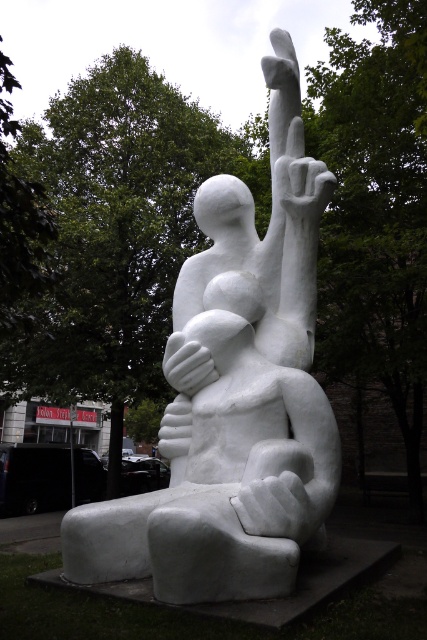
Which is in front, point (304, 200) or point (166, 348)?

Positioned in front is point (304, 200).

Can you confirm if white matte hand at upper center is bigger than white matte hand at center?

Incorrect, white matte hand at upper center is not larger than white matte hand at center.

Is point (318, 168) less distant than point (181, 349)?

No, it is not.

Find the location of `white matte hand at upper center`. white matte hand at upper center is located at coordinates (304, 188).

Is point (301, 349) closer to camera compared to point (284, 200)?

Yes, point (301, 349) is in front of point (284, 200).

Can you confirm if white stone sculpture at center is bigger than white matte hand at upper center?

Yes, white stone sculpture at center is bigger than white matte hand at upper center.

Where is `white stone sculpture at center`? white stone sculpture at center is located at coordinates (233, 404).

You are a GUI agent. You are given a task and a screenshot of the screen. Output one action in this format:
    pyautogui.click(x=<x>, y=<y>)
    Task: Click on the white stone sculpture at center
    Image resolution: width=427 pixels, height=640 pixels.
    Given the screenshot: What is the action you would take?
    pyautogui.click(x=233, y=404)

Who is positioned more to the right, white stone sculpture at center or white matte hand at center?

white stone sculpture at center

Between point (254, 300) and point (169, 371), which one is positioned in front?

Point (169, 371) is more forward.

Is point (263, 60) farther from viewer compared to point (199, 372)?

Yes, it is.

This screenshot has height=640, width=427. Find the location of `white stone sculpture at center`. white stone sculpture at center is located at coordinates (233, 404).